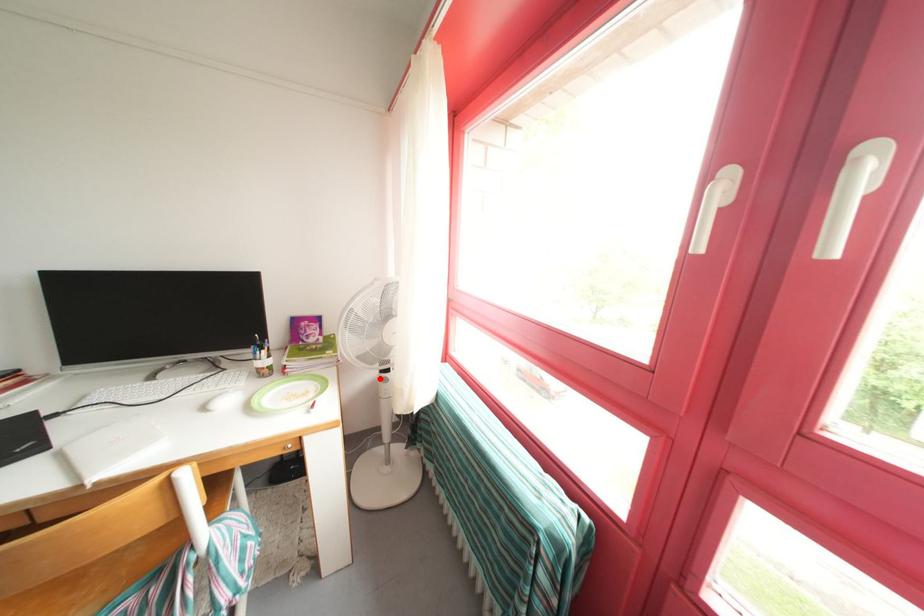
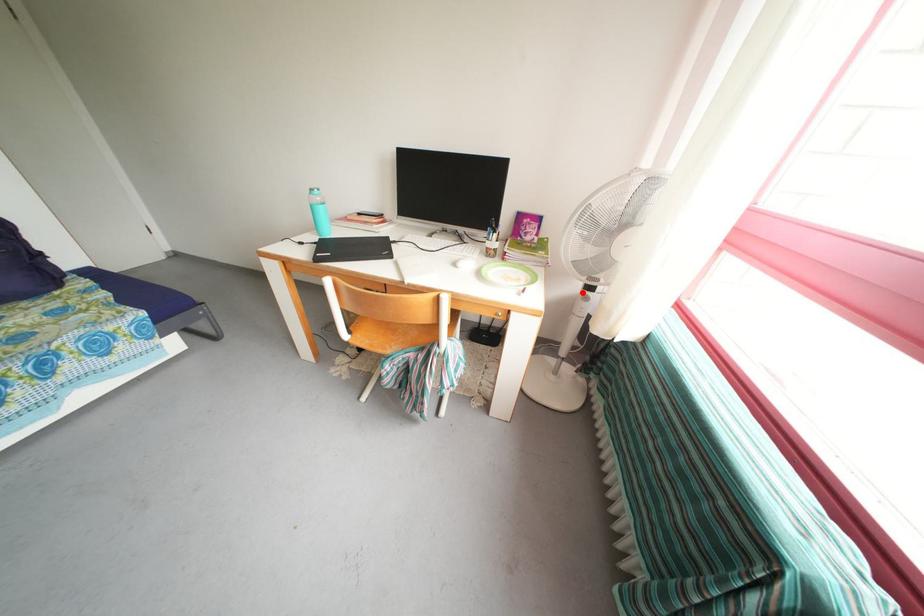
I am providing you with two images of the same scene from different viewpoints. A red point is marked on the first image and another point is marked on the second image. Does the point marked in image1 correspond to the same location as the one in image2?

Yes